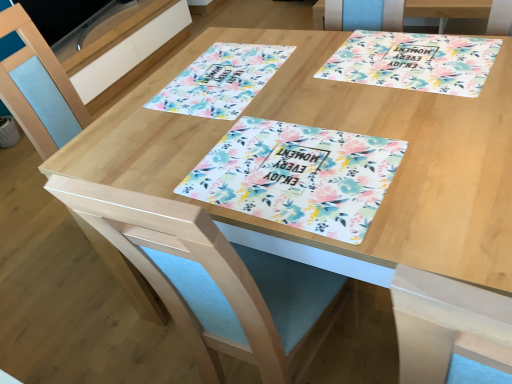
Where is `white glossy drawer at upper left`? This screenshot has height=384, width=512. white glossy drawer at upper left is located at coordinates (130, 52).

Describe the element at coordinates (213, 279) in the screenshot. I see `blue fabric swivel chair at center` at that location.

What is the approximate height of floral paper placemat at center, the 2th flyer positioned from the top?

3.41 centimeters.

Find the location of `floral paper placemat at center, the 2th flyer positioned from the top`. floral paper placemat at center, the 2th flyer positioned from the top is located at coordinates (298, 176).

This screenshot has height=384, width=512. Describe the element at coordinates (221, 80) in the screenshot. I see `floral paper placemat at upper center, which is the 2th flyer in bottom-to-top order` at that location.

You are a GUI agent. You are given a task and a screenshot of the screen. Output one action in this format:
    pyautogui.click(x=<x>, y=<y>)
    Task: Click on the light blue fabric chair at lower left
    The image size is (512, 384).
    Given the screenshot: What is the action you would take?
    pyautogui.click(x=48, y=77)

Locate an element on the screen. This screenshot has height=384, width=512. white glossy drawer at upper left is located at coordinates (130, 52).

Which is in front, point (354, 48) or point (145, 33)?

The point (354, 48) is closer.

Looking at this image, from a real-world perspective, is floral paper placemat at upper right on white glossy drawer at upper left?

Yes, from a real-world perspective, floral paper placemat at upper right is over white glossy drawer at upper left

Is floral paper placemat at upper right facing away from white glossy drawer at upper left?

That's not correct — floral paper placemat at upper right is not looking away from white glossy drawer at upper left.

Identify the location of drawer that is under the floral paper placemat at upper center, which is the 2th flyer in bottom-to-top order (from a real-world perspective). This screenshot has width=512, height=384. (130, 52).

From a real-world perspective, who is located higher, floral paper placemat at upper center, acting as the second flyer starting from the front, or white glossy drawer at upper left?

From a 3D spatial view, floral paper placemat at upper center, acting as the second flyer starting from the front, is above.

Considering the sizes of objects floral paper placemat at upper center, marked as the 1th flyer in a top-to-bottom arrangement, and white glossy drawer at upper left in the image provided, who is bigger, floral paper placemat at upper center, marked as the 1th flyer in a top-to-bottom arrangement, or white glossy drawer at upper left?

With larger size is white glossy drawer at upper left.

Between floral paper placemat at upper center, which is the 2th flyer in bottom-to-top order, and white glossy drawer at upper left, which one has less height?

Standing shorter between the two is floral paper placemat at upper center, which is the 2th flyer in bottom-to-top order.

Which of these two, blue fabric swivel chair at center or light blue fabric chair at lower left, is thinner?

blue fabric swivel chair at center is thinner.

How different are the orientations of blue fabric swivel chair at center and light blue fabric chair at lower left in degrees?

There is a 90-degree angle between the facing directions of blue fabric swivel chair at center and light blue fabric chair at lower left.

Is point (186, 230) positioned after point (109, 250)?

No, (186, 230) is closer to viewer.

Considering the sizes of objects blue fabric swivel chair at center and light blue fabric chair at lower left in the image provided, who is taller, blue fabric swivel chair at center or light blue fabric chair at lower left?

blue fabric swivel chair at center.

Is light blue fabric chair at lower left turned away from floral paper placemat at upper right?

That's not correct — light blue fabric chair at lower left is not looking away from floral paper placemat at upper right.

Considering the relative sizes of light blue fabric chair at lower left and floral paper placemat at upper right in the image provided, is light blue fabric chair at lower left wider than floral paper placemat at upper right?

Indeed, light blue fabric chair at lower left has a greater width compared to floral paper placemat at upper right.

Which object is further away from the camera taking this photo, light blue fabric chair at lower left or floral paper placemat at upper right?

light blue fabric chair at lower left is further away from the camera.

Is point (64, 86) positioned before point (434, 90)?

That is False.

From the image's perspective, which flyer is the 1st one below the white glossy drawer at upper left? Please provide its 2D coordinates.

[(221, 80)]

Is white glossy drawer at upper left inside the boundaries of floral paper placemat at upper center, positioned as the first flyer in back-to-front order, or outside?

white glossy drawer at upper left exists outside the volume of floral paper placemat at upper center, positioned as the first flyer in back-to-front order.

How different are the orientations of white glossy drawer at upper left and floral paper placemat at upper center, which is the 2th flyer in bottom-to-top order, in degrees?

The angle between the facing direction of white glossy drawer at upper left and the facing direction of floral paper placemat at upper center, which is the 2th flyer in bottom-to-top order, is 88.5 degrees.

Who is more distant, white glossy drawer at upper left or floral paper placemat at upper center, which is the 2th flyer in bottom-to-top order?

white glossy drawer at upper left is further away from the camera.

Is white glossy drawer at upper left far from floral paper placemat at upper right?

Yes.

Which object is thinner, white glossy drawer at upper left or floral paper placemat at upper right?

With smaller width is floral paper placemat at upper right.

From the image's perspective, which one is positioned lower, white glossy drawer at upper left or floral paper placemat at upper right?

floral paper placemat at upper right.

From a real-world perspective, which object rests below the other?

In real-world perspective, white glossy drawer at upper left is lower.

Is blue fabric swivel chair at center beside floral paper placemat at upper right?

No.

Considering the relative sizes of blue fabric swivel chair at center and floral paper placemat at upper right in the image provided, is blue fabric swivel chair at center wider than floral paper placemat at upper right?

Correct, the width of blue fabric swivel chair at center exceeds that of floral paper placemat at upper right.

Image resolution: width=512 pixels, height=384 pixels. I want to click on drawer that appears behind the floral paper placemat at upper right, so click(x=130, y=52).

The height and width of the screenshot is (384, 512). Find the location of `drawer on the left of the floral paper placemat at upper center, acting as the second flyer starting from the front`. drawer on the left of the floral paper placemat at upper center, acting as the second flyer starting from the front is located at coordinates (130, 52).

From the image, which object appears to be farther from blue fabric swivel chair at center, floral paper placemat at center, positioned as the 1th flyer in front-to-back order, or floral paper placemat at upper center, acting as the second flyer starting from the front?

Among the two, floral paper placemat at upper center, acting as the second flyer starting from the front, is located further to blue fabric swivel chair at center.

Which object lies further to the anchor point floral paper placemat at upper center, positioned as the first flyer in back-to-front order, light blue fabric chair at lower left or floral paper placemat at upper right?

Based on the image, light blue fabric chair at lower left appears to be further to floral paper placemat at upper center, positioned as the first flyer in back-to-front order.

When comparing their distances from light blue fabric chair at lower left, does floral paper placemat at upper center, acting as the second flyer starting from the front, or white glossy drawer at upper left seem further?

white glossy drawer at upper left.

Considering their positions, is floral paper placemat at center, the second flyer when ordered from back to front, positioned further to floral paper placemat at upper center, acting as the second flyer starting from the front, than white glossy drawer at upper left?

Among the two, white glossy drawer at upper left is located further to floral paper placemat at upper center, acting as the second flyer starting from the front.

Which object lies further to the anchor point floral paper placemat at upper right, floral paper placemat at upper center, which is the 2th flyer in bottom-to-top order, or white glossy drawer at upper left?

white glossy drawer at upper left is positioned further to the anchor floral paper placemat at upper right.

Which object lies further to the anchor point blue fabric swivel chair at center, light blue fabric chair at lower left or floral paper placemat at center, positioned as the 1th flyer in front-to-back order?

Based on the image, light blue fabric chair at lower left appears to be further to blue fabric swivel chair at center.

Estimate the real-world distances between objects in this image. Which object is closer to light blue fabric chair at lower left, white glossy drawer at upper left or floral paper placemat at upper right?

floral paper placemat at upper right.

Looking at the image, which one is located further to blue fabric swivel chair at center, light blue fabric chair at lower left or floral paper placemat at upper center, acting as the second flyer starting from the front?

light blue fabric chair at lower left.

Locate an element on the screen. The width and height of the screenshot is (512, 384). flyer between floral paper placemat at upper right and blue fabric swivel chair at center vertically is located at coordinates (298, 176).

Identify the location of chair between floral paper placemat at upper right and white glossy drawer at upper left along the z-axis. Image resolution: width=512 pixels, height=384 pixels. (48, 77).

The image size is (512, 384). Find the location of `swivel chair between light blue fabric chair at lower left and floral paper placemat at upper right in the horizontal direction`. swivel chair between light blue fabric chair at lower left and floral paper placemat at upper right in the horizontal direction is located at coordinates (213, 279).

Where is `flyer situated between light blue fabric chair at lower left and floral paper placemat at center, positioned as the 1th flyer in front-to-back order, from left to right`? flyer situated between light blue fabric chair at lower left and floral paper placemat at center, positioned as the 1th flyer in front-to-back order, from left to right is located at coordinates (221, 80).